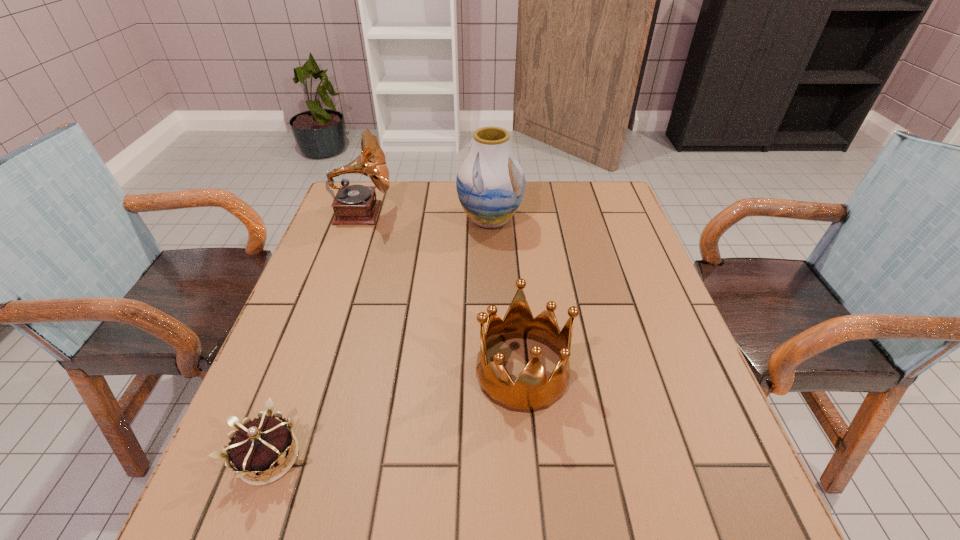
Where is `vase`? This screenshot has width=960, height=540. vase is located at coordinates (490, 183).

The height and width of the screenshot is (540, 960). Identify the location of phonograph_record. (355, 204).

Where is `the right crown`? the right crown is located at coordinates (532, 391).

Where is `the second nearest object`? The height and width of the screenshot is (540, 960). the second nearest object is located at coordinates (532, 391).

Image resolution: width=960 pixels, height=540 pixels. Find the location of `the shortest object`. the shortest object is located at coordinates (259, 446).

Locate an element on the screen. Image resolution: width=960 pixels, height=540 pixels. the nearest object is located at coordinates (259, 446).

Locate an element on the screen. The image size is (960, 540). vacant space situated on the front of the vase is located at coordinates (491, 251).

The width and height of the screenshot is (960, 540). I want to click on blank space located 0.400m on the horn of the phonograph_record, so click(525, 213).

The image size is (960, 540). Identify the location of vacant region located 0.060m on the right of the farther crown. (598, 372).

Where is `vacant space situated 0.190m on the right of the shorter crown`? The image size is (960, 540). vacant space situated 0.190m on the right of the shorter crown is located at coordinates (413, 457).